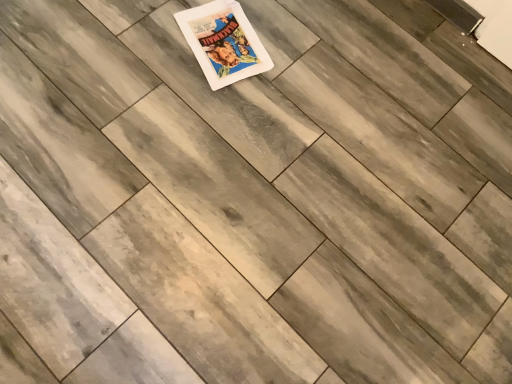
Locate an element on the screen. The width and height of the screenshot is (512, 384). vacant location below matte white comic book at upper center (from a real-world perspective) is located at coordinates (226, 47).